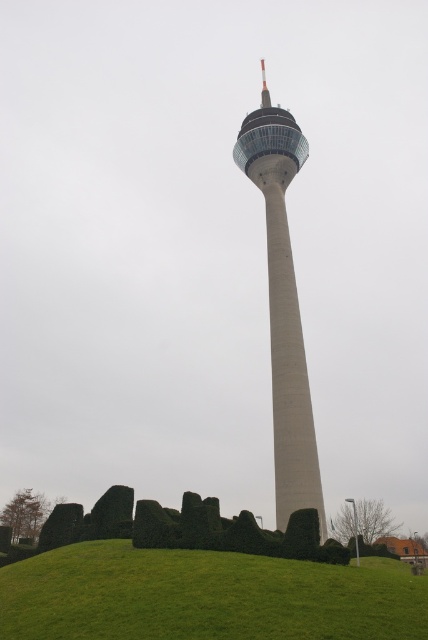
Who is lower down, green grassy hill at lower center or green bushy hedge at lower center?

green grassy hill at lower center is below.

Between point (62, 564) and point (211, 538), which one is positioned behind?

The point (211, 538) is behind.

Is point (128, 541) farther from camera compared to point (249, 524)?

Yes, point (128, 541) is farther from viewer.

Image resolution: width=428 pixels, height=640 pixels. In order to click on green grassy hill at lower center in this screenshot , I will do `click(205, 596)`.

Between point (270, 275) and point (344, 557), which one is positioned in front?

Point (344, 557) is more forward.

Between point (306, 410) and point (297, 513), which one is positioned behind?

The point (306, 410) is more distant.

This screenshot has width=428, height=640. I want to click on smooth concrete tower at center, so click(282, 307).

Is the position of green grassy hill at lower center more distant than that of smooth concrete tower at center?

No, green grassy hill at lower center is closer to the viewer.

Does green grassy hill at lower center have a lesser height compared to smooth concrete tower at center?

Yes.

Is point (235, 621) positioned after point (285, 179)?

No, (235, 621) is in front of (285, 179).

The image size is (428, 640). In order to click on green grassy hill at lower center in this screenshot , I will do tap(205, 596).